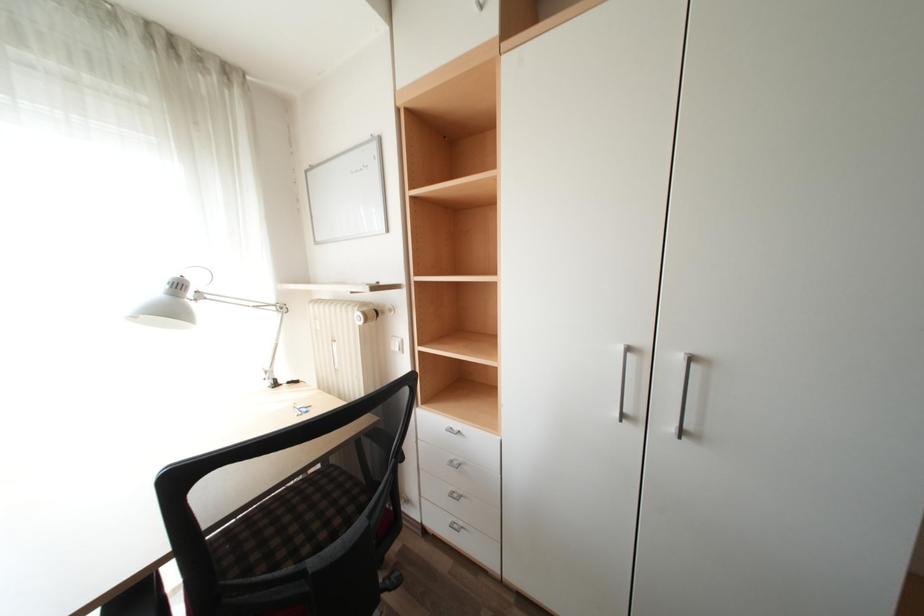
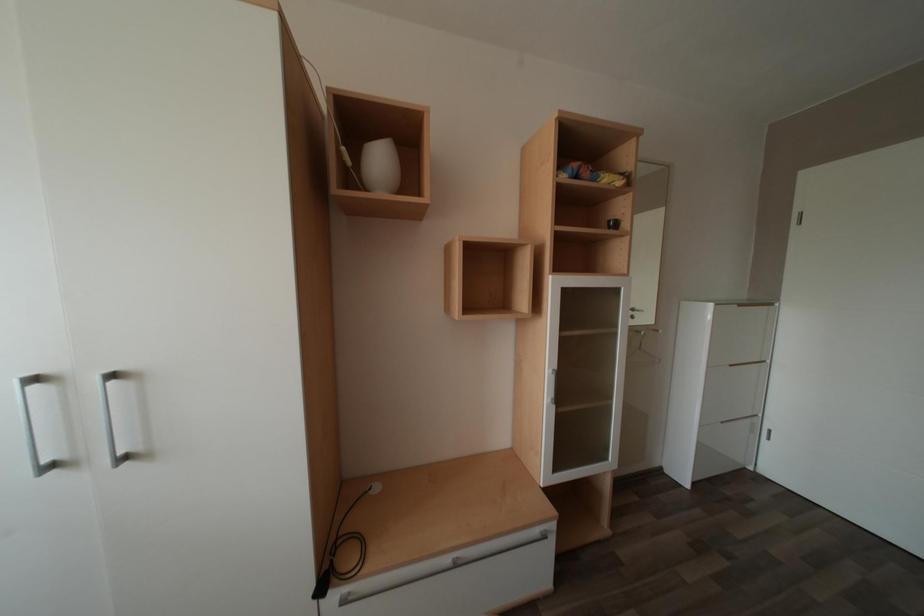
Question: How did the camera likely rotate?

Choices:
 (A) Left
 (B) Right
 (C) Up
 (D) Down

Answer: (B)